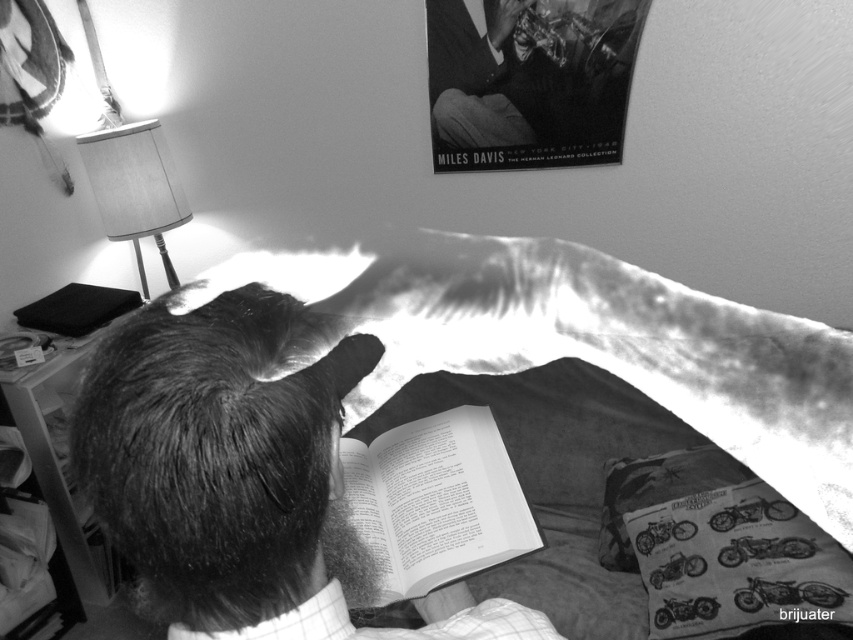
You are an interior designer assessing the lighting in this room. You notice the smooth skin at upper center and the matte fabric lampshade at upper left. Which object is positioned closer to the camera?

The smooth skin at upper center is closer to the viewer than the matte fabric lampshade at upper left.

You are a photographer who wants to capture the paperback book at center in focus while keeping the framed poster of Miles Davis on the wall blurred. Based on the scene description, what camera setting adjustment would you make to achieve this effect?

To achieve a shallow depth of field where the paperback book at center is in focus and the framed poster of Miles Davis is blurred, you would use a wide aperture setting. This narrows the area in focus, isolating the book while softening the background elements like the poster.